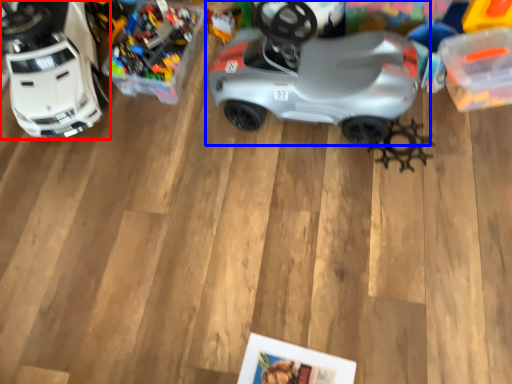
Question: Which object is closer to the camera taking this photo, toy (highlighted by a red box) or car (highlighted by a blue box)?

Choices:
 (A) toy
 (B) car

Answer: (B)